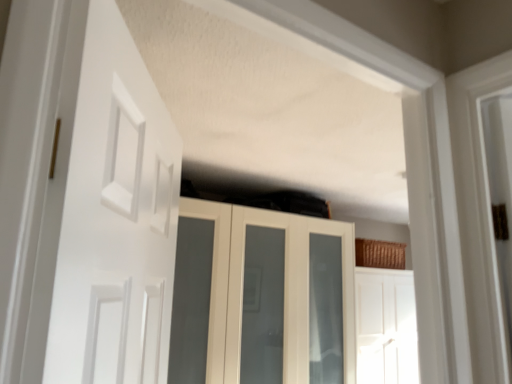
Question: In the image, is white matte door at left, the 1th door when ordered from left to right, positioned in front of or behind white glossy cupboard at upper center?

Choices:
 (A) front
 (B) behind

Answer: (A)

Question: Does point (69, 160) appear closer or farther from the camera than point (294, 254)?

Choices:
 (A) farther
 (B) closer

Answer: (B)

Question: Based on their relative distances, which object is farther from the white glossy cupboard at upper center?

Choices:
 (A) white matte door at left, the 2th door in the back-to-front sequence
 (B) white glossy door at center, placed as the first door when sorted from back to front

Answer: (A)

Question: Estimate the real-world distances between objects in this image. Which object is closer to the white glossy cupboard at upper center?

Choices:
 (A) white glossy door at center, marked as the second door in a left-to-right arrangement
 (B) white matte door at left, which is counted as the second door, starting from the right

Answer: (A)